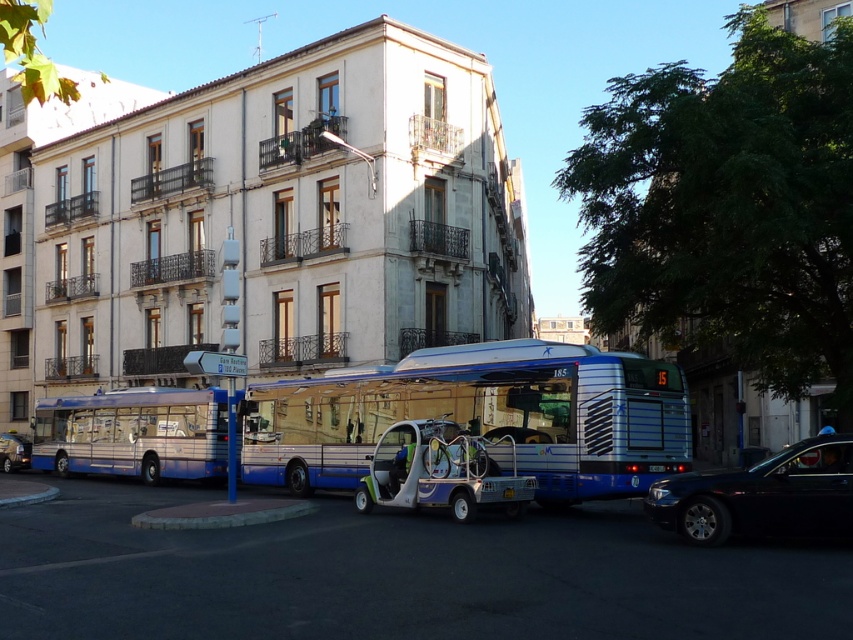
You are a delivery person who needs to park your van next to the blue metallic bus at center and the metallic blue bus at center. Which of the two buses should you park closer to if you want to ensure there is enough space for your van?

You should park closer to the metallic blue bus at center because the blue metallic bus at center might be wider, leaving less space for your van.

Looking at this image, you are standing in front of the blue and white bus labeled 185. There are two points marked on the image. The first point is at coordinate point (662, 499) and the second is at point (15, 456). From your perspective, which point is closer to you?

Point (662, 499) is closer to the camera than point (15, 456).

You are a delivery person who needs to load a tall package onto a vehicle. You have the metallic blue bus at center and the black glossy sedan at lower right available. Which vehicle should you choose to ensure the package fits vertically?

The metallic blue bus at center has a greater height compared to the black glossy sedan at lower right, so you should choose the metallic blue bus at center to ensure the package fits vertically.